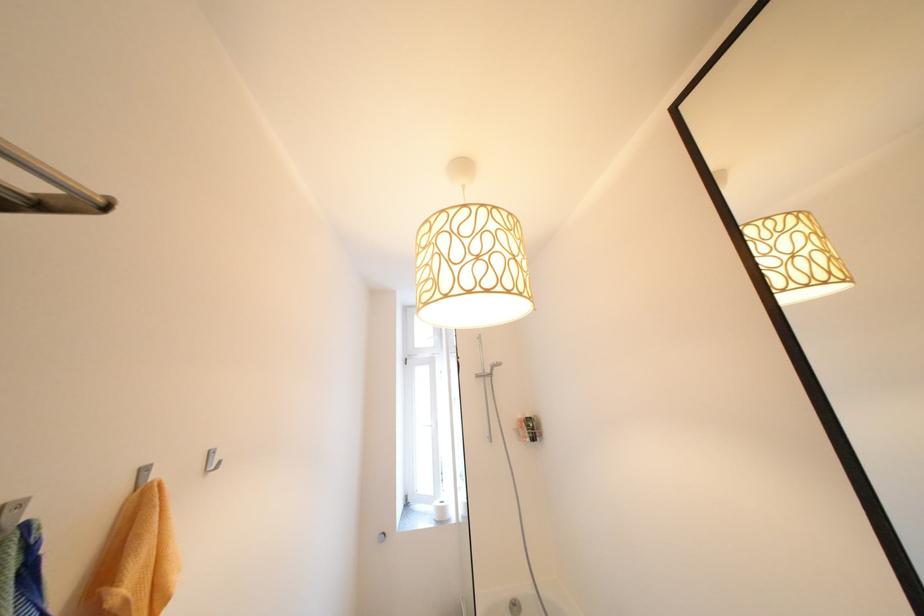
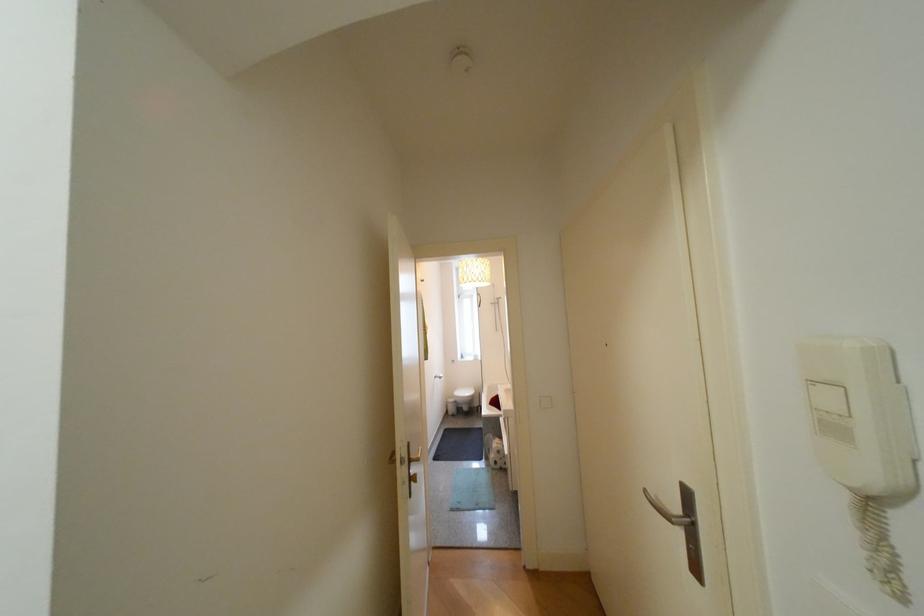
Question: The images are taken continuously from a first-person perspective. In which direction are you moving?

Choices:
 (A) Left
 (B) Right
 (C) Forward
 (D) Backward

Answer: (D)